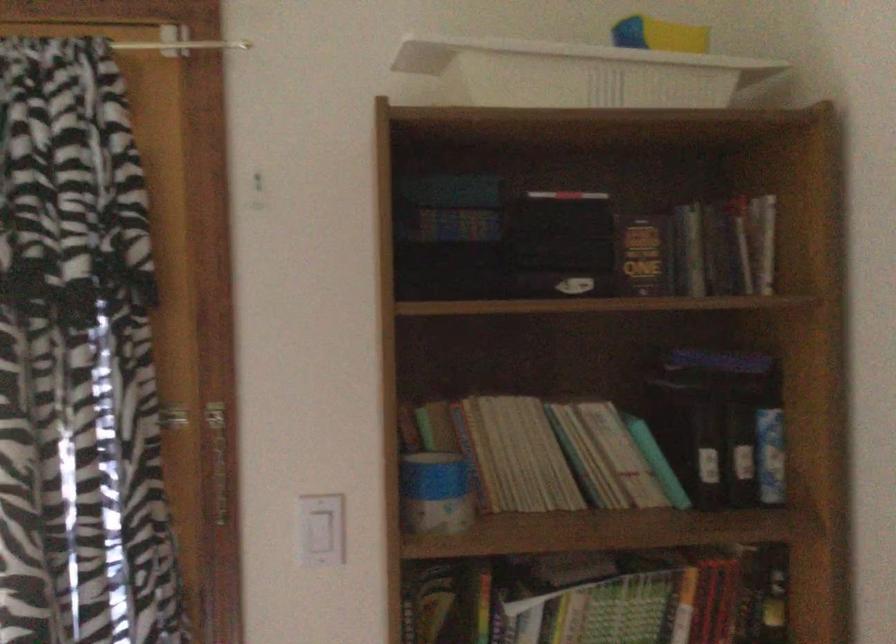
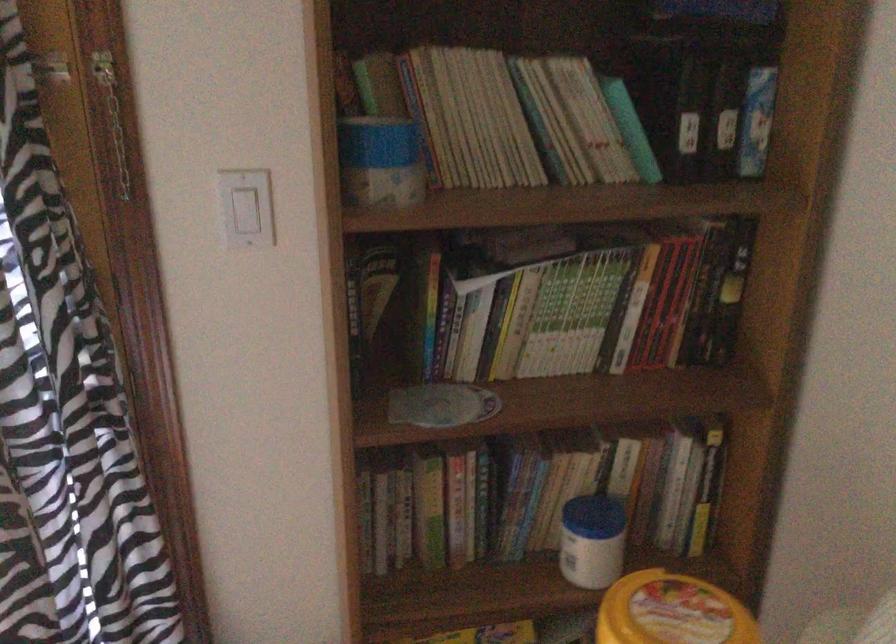
Question: What movement of the cameraman would produce the second image?

Choices:
 (A) Left
 (B) Right
 (C) Forward
 (D) Backward

Answer: (C)